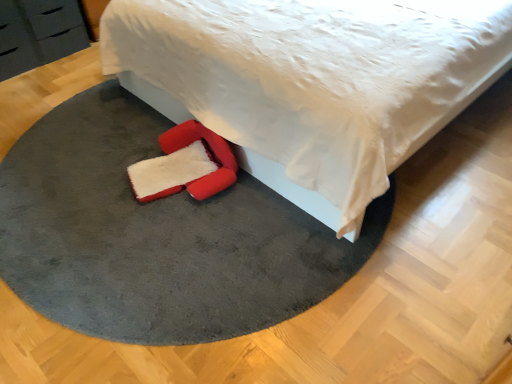
Question: Looking at the image, does black matte drawer at upper left seem bigger or smaller compared to matte black dresser at upper left?

Choices:
 (A) small
 (B) big

Answer: (A)

Question: In the image, is black matte drawer at upper left positioned in front of or behind matte black dresser at upper left?

Choices:
 (A) front
 (B) behind

Answer: (A)

Question: Which of these objects is positioned farthest from the velvet-like red footrest at lower center?

Choices:
 (A) white soft bed at center
 (B) black matte drawer at upper left
 (C) matte black dresser at upper left
 (D) velvet gray rug at center

Answer: (B)

Question: Estimate the real-world distances between objects in this image. Which object is closer to the velvet gray rug at center?

Choices:
 (A) velvet-like red footrest at lower center
 (B) black matte drawer at upper left
 (C) white soft bed at center
 (D) matte black dresser at upper left

Answer: (A)